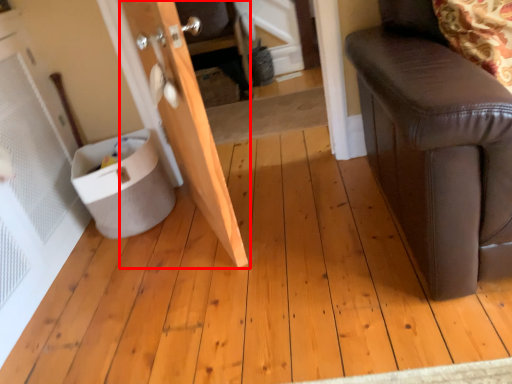
Question: From the image's perspective, considering the relative positions of door (annotated by the red box) and potty in the image provided, where is door (annotated by the red box) located with respect to the staircase?

Choices:
 (A) above
 (B) below

Answer: (A)